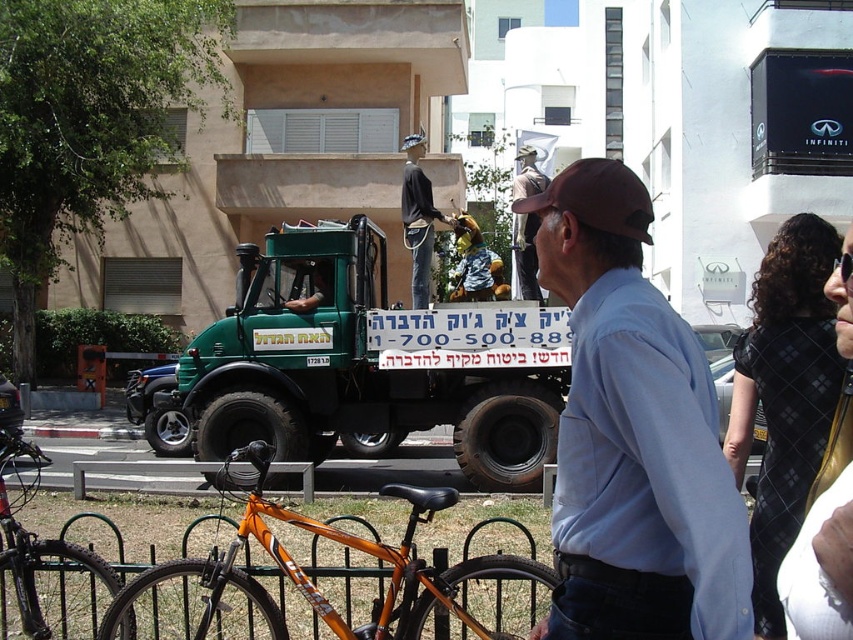
Is point (425, 216) positioned behind point (532, 180)?

That is True.

Does dark gray fabric mannequin at center lie in front of matte gray statue at center?

Yes, dark gray fabric mannequin at center is closer to the viewer.

Locate an element on the screen. dark gray fabric mannequin at center is located at coordinates (418, 220).

Identify the location of dark gray fabric mannequin at center. (418, 220).

In the scene shown: Does orange matte bicycle at lower center have a greater height compared to matte gray statue at center?

Indeed, orange matte bicycle at lower center has a greater height compared to matte gray statue at center.

Which is in front, point (376, 620) or point (537, 182)?

Positioned in front is point (376, 620).

Which is in front, point (202, 628) or point (534, 266)?

Point (202, 628) is more forward.

Where is `orange matte bicycle at lower center`? The image size is (853, 640). orange matte bicycle at lower center is located at coordinates (312, 577).

Who is higher up, green matte truck at center or dark gray fabric mannequin at center?

Positioned higher is dark gray fabric mannequin at center.

Is green matte truck at center to the right of dark gray fabric mannequin at center from the viewer's perspective?

Incorrect, green matte truck at center is not on the right side of dark gray fabric mannequin at center.

Does point (251, 272) come farther from viewer compared to point (418, 224)?

Yes, it is behind point (418, 224).

Find the location of `green matte truck at center`. green matte truck at center is located at coordinates (364, 364).